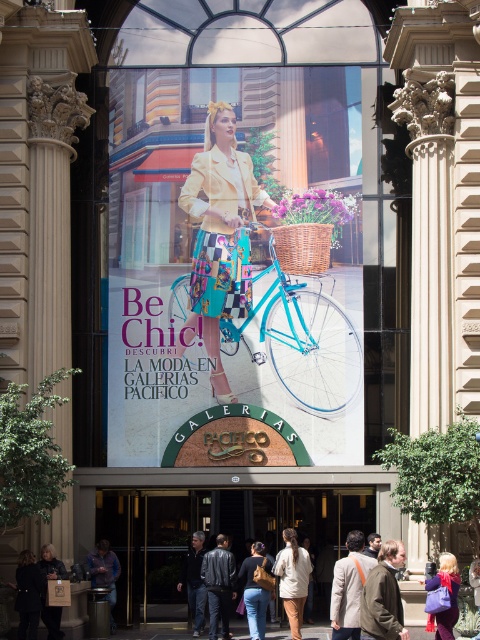
In the scene shown: You are a customer entering Galerias Pacifico and see the advertisement with the brown leather jacket at lower center and the dark brown leather coat at lower left. Which item is positioned closer to the right side of the advertisement?

The brown leather jacket at lower center is positioned closer to the right side of the advertisement because it is to the right of the dark brown leather coat at lower left.

From the picture: You are standing at the entrance of Galerias Pacifico and want to take a photo of the large advertisement on the glass facade. The advertisement is located at point [317,298]. If your camera has a maximum focus range of 200 feet, will you be able to focus on the advertisement?

The distance between you and point [317,298] is 237.82 feet, which exceeds the camera maximum focus range of 200 feet. Therefore, you cannot focus on the advertisement.